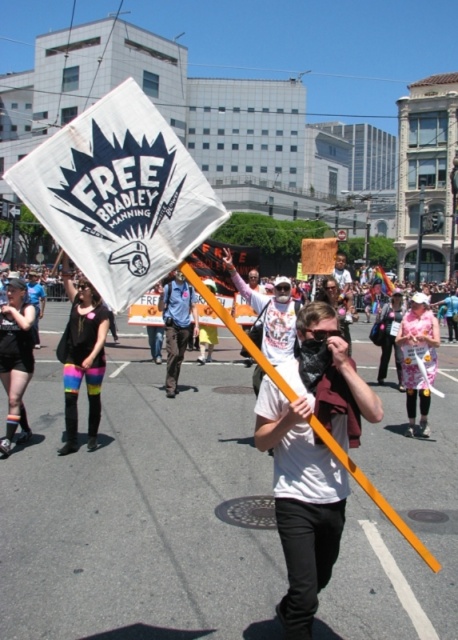
Question: Estimate the real-world distances between objects in this image. Which object is closer to the blue uniform at center?

Choices:
 (A) rainbow leggings at center
 (B) white matte t-shirt at center
 (C) white paper flag at center

Answer: (A)

Question: Does rainbow leggings at center have a smaller size compared to blue uniform at center?

Choices:
 (A) no
 (B) yes

Answer: (B)

Question: Is white matte t-shirt at center wider than pink floral dress at center?

Choices:
 (A) yes
 (B) no

Answer: (B)

Question: Which object is positioned farthest from the rainbow striped leggings at left?

Choices:
 (A) white matte t-shirt at center
 (B) rainbow leggings at center

Answer: (A)

Question: Considering the real-world distances, which object is farthest from the rainbow striped leggings at left?

Choices:
 (A) white paper flag at center
 (B) pink floral dress at center
 (C) white matte t-shirt at center
 (D) blue uniform at center

Answer: (B)

Question: Is white paper flag at center thinner than pink floral dress at center?

Choices:
 (A) no
 (B) yes

Answer: (A)